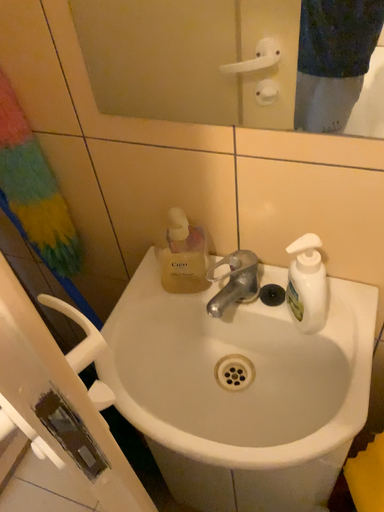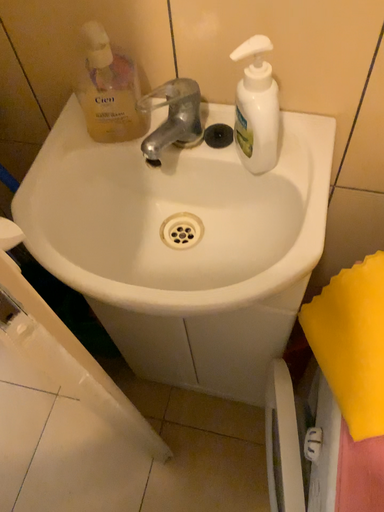
Question: How did the camera likely rotate when shooting the video?

Choices:
 (A) rotated upward
 (B) rotated downward

Answer: (B)